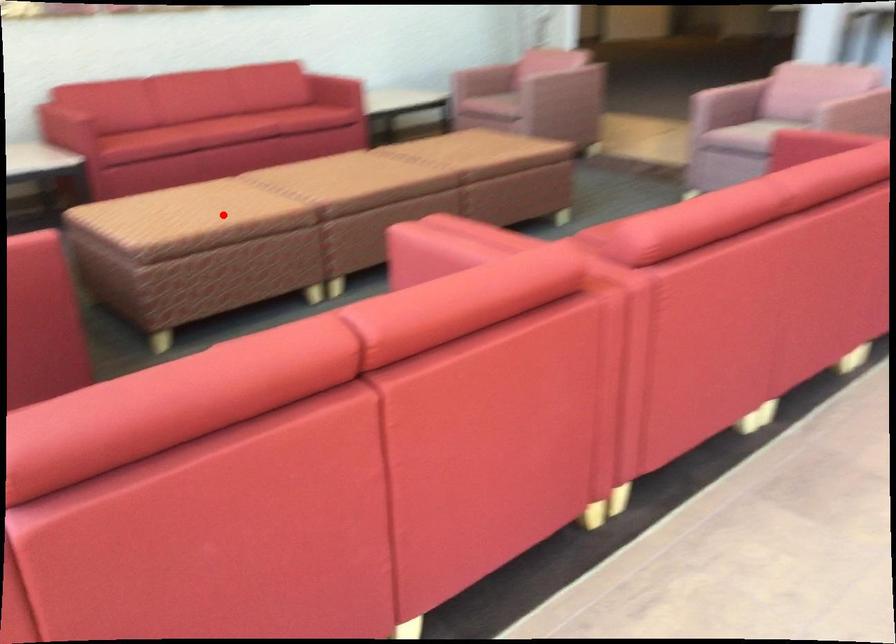
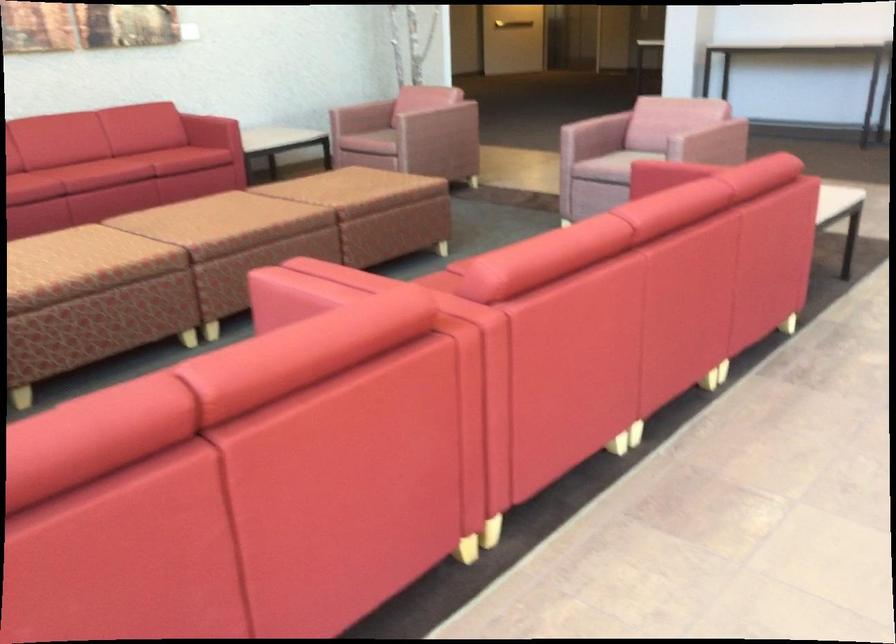
In the second image, find the point that corresponds to the highlighted location in the first image.

(83, 265)